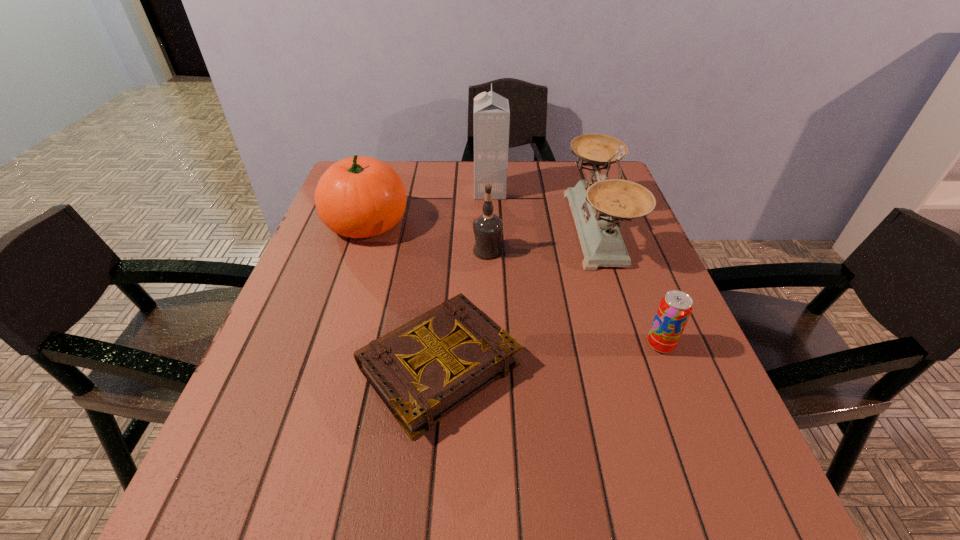
Identify the location of pumpkin that is positioned at the far edge. (358, 197).

The image size is (960, 540). I want to click on object that is at the left edge, so click(x=358, y=197).

Where is `scale that is at the right edge`? The height and width of the screenshot is (540, 960). scale that is at the right edge is located at coordinates 598,207.

You are a GUI agent. You are given a task and a screenshot of the screen. Output one action in this format:
    pyautogui.click(x=<x>, y=<y>)
    Task: Click on the soda can located at the right edge
    The height and width of the screenshot is (540, 960).
    Given the screenshot: What is the action you would take?
    pyautogui.click(x=675, y=308)

Locate an element on the screen. object located at the far left corner is located at coordinates (358, 197).

Find the location of a particular element. object that is at the far right corner is located at coordinates (598, 207).

In order to click on vacant space at the far edge of the desktop in this screenshot , I will do `click(441, 191)`.

This screenshot has height=540, width=960. Identify the location of vacant space at the left edge. (342, 312).

Where is `blank area at the right edge`? The image size is (960, 540). blank area at the right edge is located at coordinates (632, 352).

The image size is (960, 540). In the image, there is a desktop. In order to click on free space at the far right corner in this screenshot , I will do `click(566, 174)`.